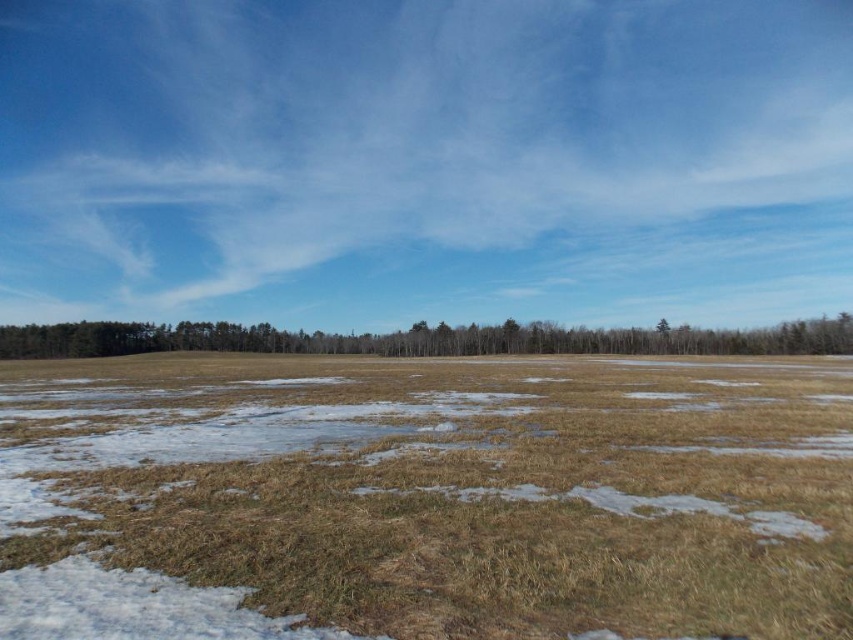
Is brown dry grass at center taller than brown matte trees at center?

Incorrect, brown dry grass at center's height is not larger of brown matte trees at center's.

In the scene shown: Is brown dry grass at center thinner than brown matte trees at center?

Correct, brown dry grass at center's width is less than brown matte trees at center's.

Is point (129, 582) positioned before point (186, 344)?

Yes, point (129, 582) is closer to viewer.

Find the location of a particular element. This screenshot has width=853, height=640. brown dry grass at center is located at coordinates (425, 497).